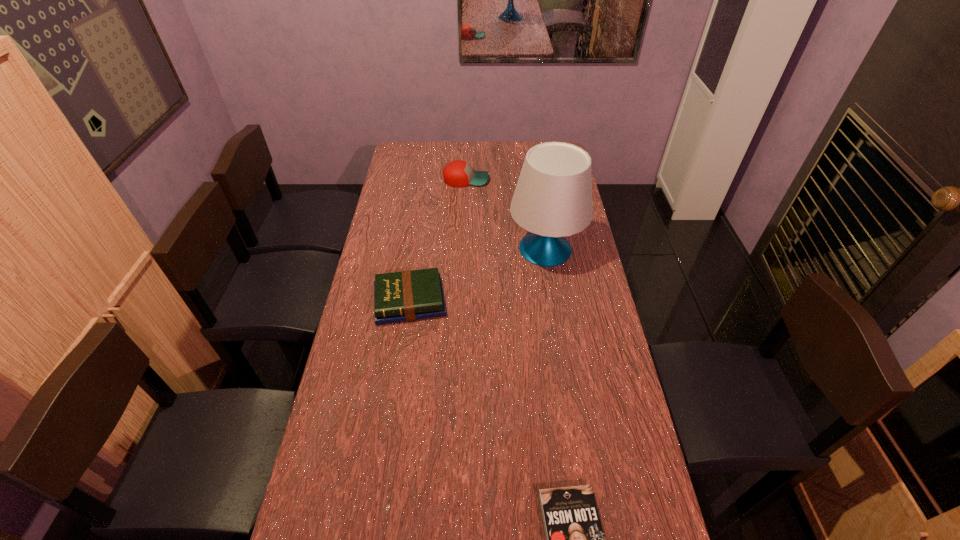
I want to click on the tallest object, so click(553, 198).

You are a GUI agent. You are given a task and a screenshot of the screen. Output one action in this format:
    pyautogui.click(x=<x>, y=<y>)
    Task: Click on the third nearest object
    
    Given the screenshot: What is the action you would take?
    pyautogui.click(x=553, y=198)

The height and width of the screenshot is (540, 960). Find the location of `the third shortest object`. the third shortest object is located at coordinates (458, 173).

Where is `the farthest object`? Image resolution: width=960 pixels, height=540 pixels. the farthest object is located at coordinates (458, 173).

Locate an element on the screen. the farther book is located at coordinates (404, 296).

Identify the location of the taller book. (404, 296).

Locate an element on the screen. Image resolution: width=960 pixels, height=540 pixels. vacant area situated on the front-facing side of the tallest object is located at coordinates (552, 288).

Find the location of `free spot located at the brim of the baseball cap`. free spot located at the brim of the baseball cap is located at coordinates (509, 180).

I want to click on blank area located on the back of the third farthest object, so click(418, 248).

Identify the location of object that is positioned at the left edge. (404, 296).